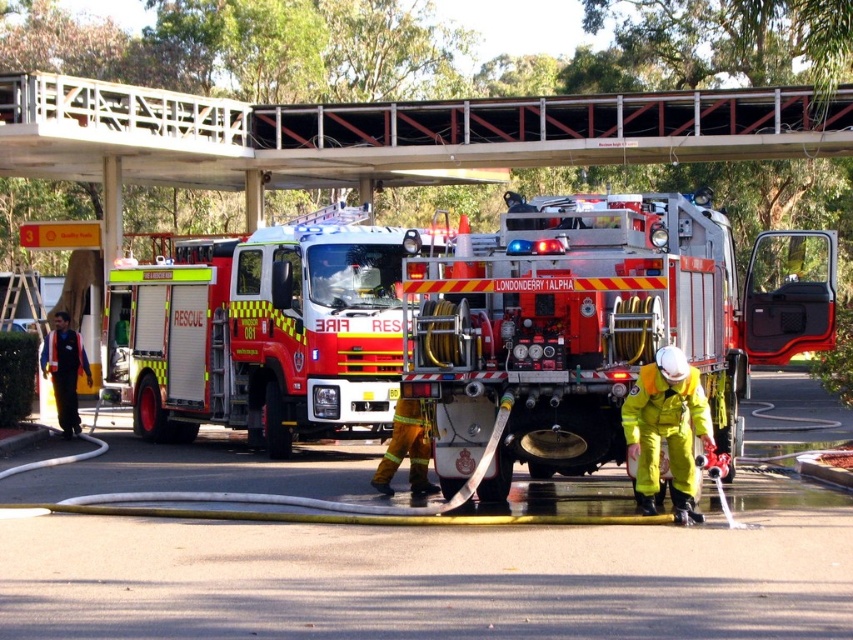
Can you confirm if red reflective fire truck at center is taller than reflective orange uniform at left?

Yes.

Which is behind, point (482, 280) or point (78, 348)?

Point (78, 348)

Between point (718, 285) and point (53, 384), which one is positioned in front?

Point (718, 285) is more forward.

At what (x,y) coordinates should I click in order to perform the action: click on red reflective fire truck at center. Please return your answer as a coordinate pair (x, y). Looking at the image, I should click on (596, 323).

Can you confirm if red/yellow reflective rescue vehicle at center is positioned to the left of yellow reflective uniform at lower right?

Indeed, red/yellow reflective rescue vehicle at center is positioned on the left side of yellow reflective uniform at lower right.

The width and height of the screenshot is (853, 640). Find the location of `red/yellow reflective rescue vehicle at center`. red/yellow reflective rescue vehicle at center is located at coordinates (260, 332).

Is point (277, 260) farther from camera compared to point (672, 390)?

Yes, it is behind point (672, 390).

This screenshot has height=640, width=853. What are the coordinates of `red/yellow reflective rescue vehicle at center` in the screenshot? It's located at (260, 332).

Does red reflective fire truck at center have a larger size compared to white metal bridge at upper center?

Indeed, red reflective fire truck at center has a larger size compared to white metal bridge at upper center.

Which of these two, red reflective fire truck at center or white metal bridge at upper center, stands shorter?

Standing shorter between the two is white metal bridge at upper center.

You are a GUI agent. You are given a task and a screenshot of the screen. Output one action in this format:
    pyautogui.click(x=<x>, y=<y>)
    Task: Click on the red reflective fire truck at center
    The image size is (853, 640).
    Given the screenshot: What is the action you would take?
    pyautogui.click(x=596, y=323)